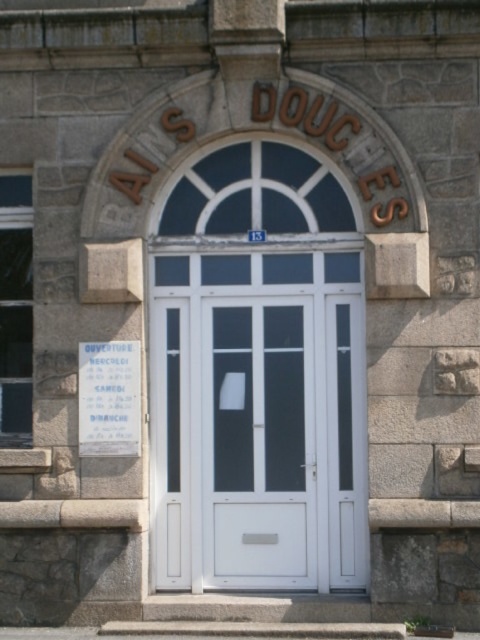
You are standing in front of the entrance of the stone building. There is a point marked at coordinates (259, 420). What object is located at that point?

The point at coordinates (259, 420) indicates the white glossy door at center.